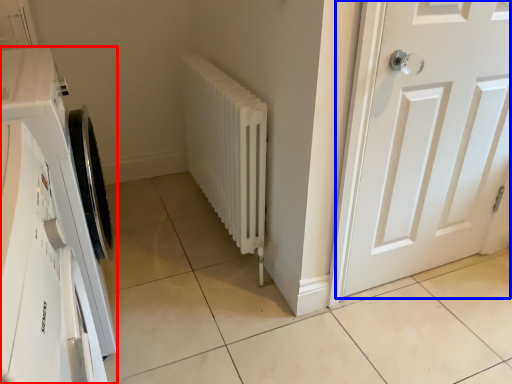
Question: Which object is further to the camera taking this photo, washing machine (highlighted by a red box) or door (highlighted by a blue box)?

Choices:
 (A) washing machine
 (B) door

Answer: (B)